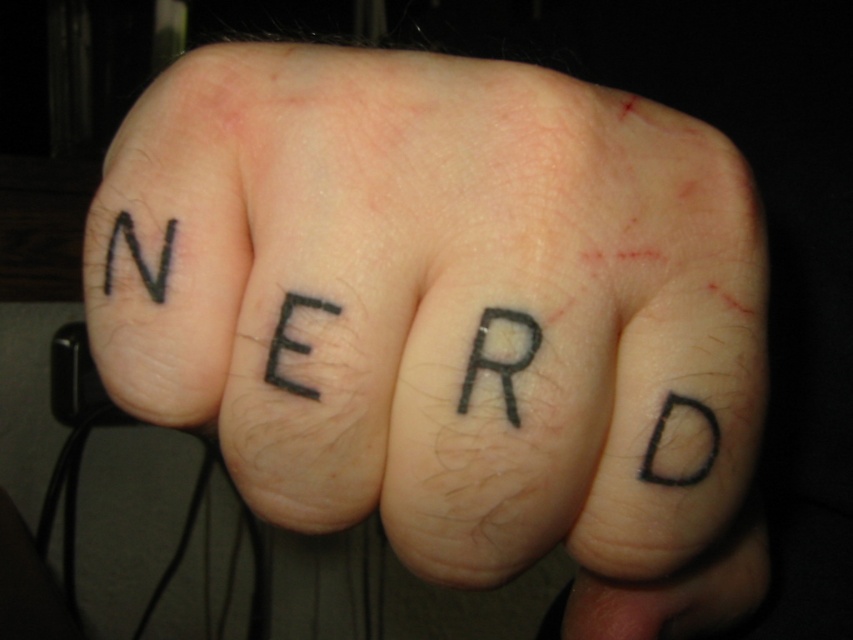
You are a tattoo artist assessing the spacing between the black ink tattoo at center and the black ink letter at upper left on a client. The client wants to know if there is enough space between them to avoid smudging during healing. The minimum safe distance for healing is 7.5 centimeters. Can you confirm if the spacing is sufficient?

The black ink tattoo at center is 7.87 centimeters away from the black ink letter at upper left. Since 7.87 cm exceeds the minimum required 7.5 cm, the spacing is sufficient to prevent smudging during healing.

You are a tattoo artist examining the image of a fist with tattoos. You need to locate the exact point specified. Is the point at coordinates point (451,316) located on the black ink tattoo at center?

Yes, the point (451,316) is on the black ink tattoo at center as stated in the Objects Description.

You are a tattoo artist examining a client who has a black ink tattoo at center and a black ink letter at upper left on their hand. The client wants to add a new tattoo between them. Can you fit it there without overlapping?

The black ink tattoo at center is in front of the black ink letter at upper left, meaning they are already positioned close enough that adding a new tattoo between them would cause overlap. Therefore, it is not possible to fit a new tattoo between them without overlapping.